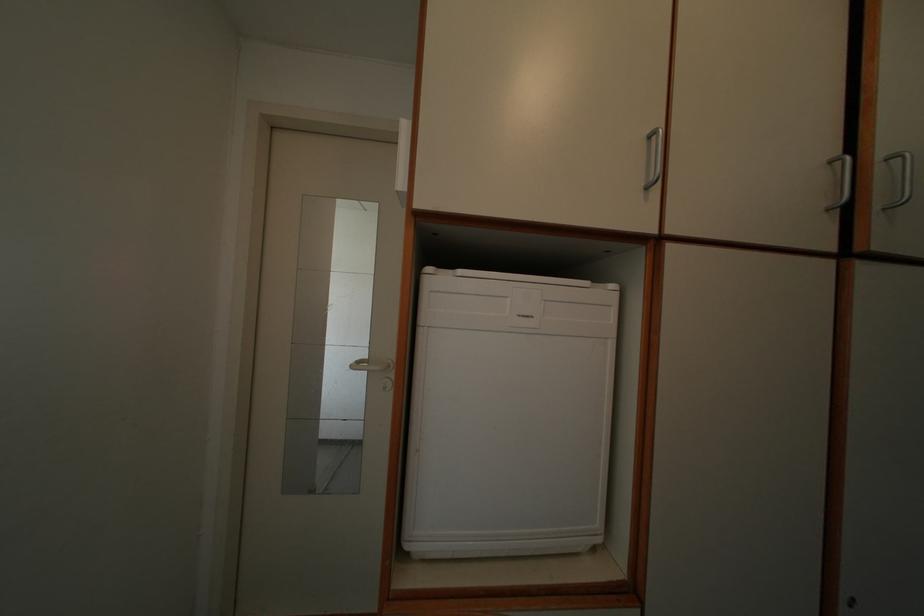
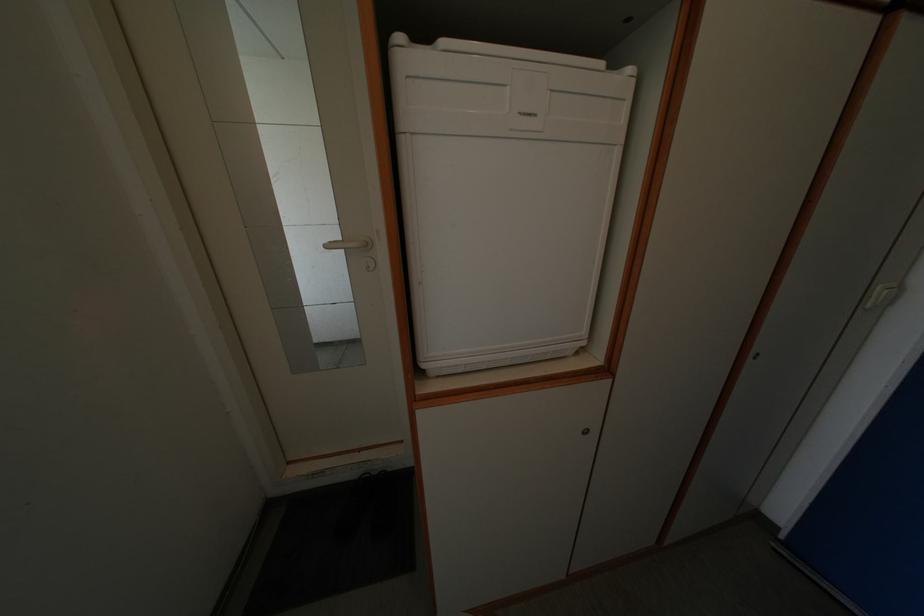
Find the pixel in the second image that matches point 539,322 in the first image.

(542, 120)